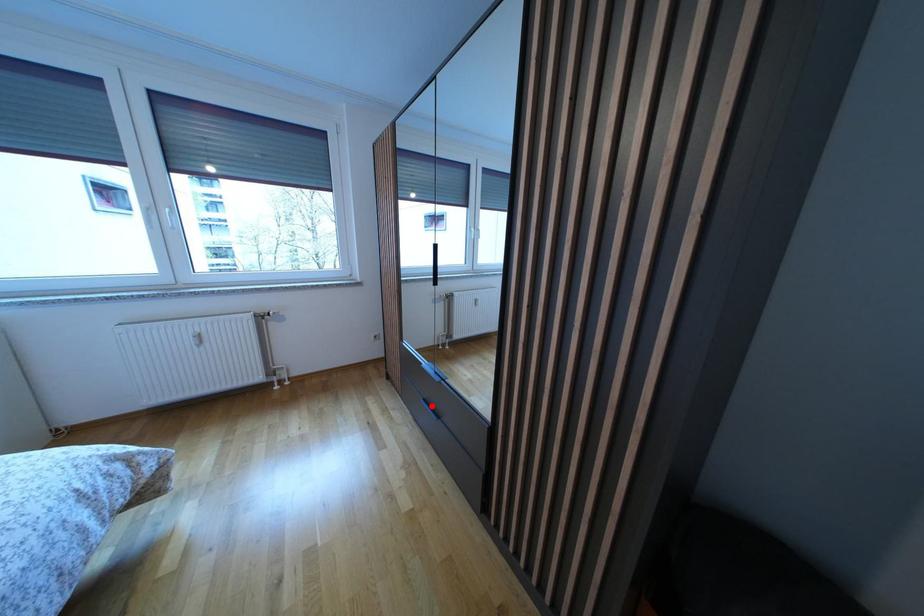
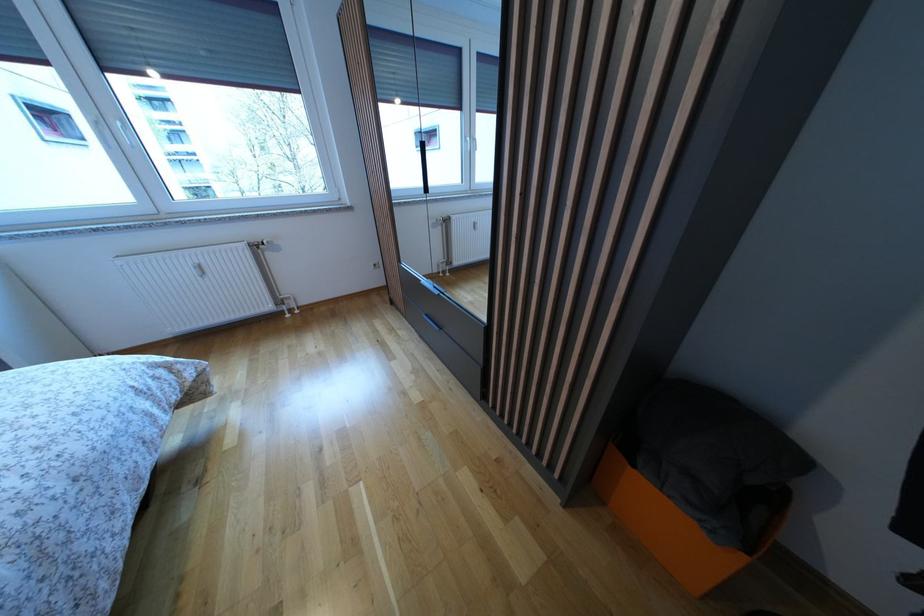
Question: I am providing you with two images of the same scene from different viewpoints. In image1, a red point is highlighted. Considering the same 3D point in image2, which of the following is correct?

Choices:
 (A) It is closer
 (B) It is farther

Answer: (A)